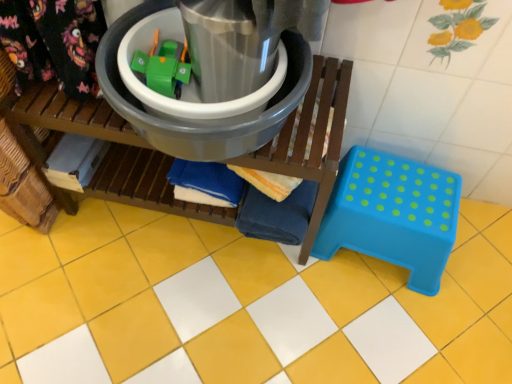
Question: Is matte plastic bucket at center taller or shorter than blue plastic step stool at lower right?

Choices:
 (A) short
 (B) tall

Answer: (B)

Question: From the image's perspective, relative to blue plastic step stool at lower right, is matte plastic bucket at center above or below?

Choices:
 (A) below
 (B) above

Answer: (B)

Question: Based on their relative distances, which object is farther from the matte plastic bucket at center?

Choices:
 (A) metallic plastic bucket at center
 (B) blue plastic step stool at lower right
 (C) yellow glossy tile at center

Answer: (B)

Question: Considering the real-world distances, which object is farthest from the blue plastic step stool at lower right?

Choices:
 (A) yellow glossy tile at center
 (B) metallic plastic bucket at center
 (C) matte plastic bucket at center

Answer: (B)